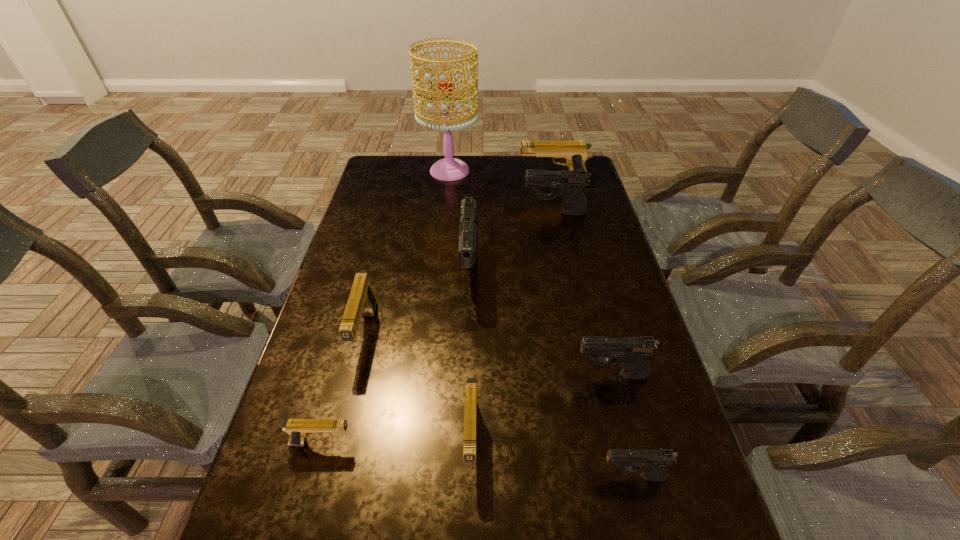
Where is `pistol located in the far edge section of the desktop`? This screenshot has width=960, height=540. pistol located in the far edge section of the desktop is located at coordinates click(x=574, y=154).

Find the location of a particular element. The width and height of the screenshot is (960, 540). object present at the far right corner is located at coordinates (574, 154).

Image resolution: width=960 pixels, height=540 pixels. In order to click on free region at the far edge of the desktop in this screenshot , I will do `click(413, 178)`.

In the image, there is a desktop. What are the coordinates of `blank space at the left edge` in the screenshot? It's located at [339, 256].

Locate an element on the screen. free region at the right edge of the desktop is located at coordinates (605, 232).

In the image, there is a desktop. At what (x,y) coordinates should I click in order to perform the action: click on vacant space at the far left corner. Please return your answer as a coordinate pair (x, y). The image size is (960, 540). Looking at the image, I should click on (407, 181).

Identify the location of vacant area that lies between the tallest object and the smallest black pistol. (541, 324).

This screenshot has height=540, width=960. I want to click on free spot between the tallest pistol and the nearest black pistol, so click(552, 374).

The image size is (960, 540). Identify the location of vacant area that lies between the tallest object and the second farthest tan pistol. (407, 252).

The height and width of the screenshot is (540, 960). Identify the location of unoccupied position between the second smallest black pistol and the lampshade. (531, 273).